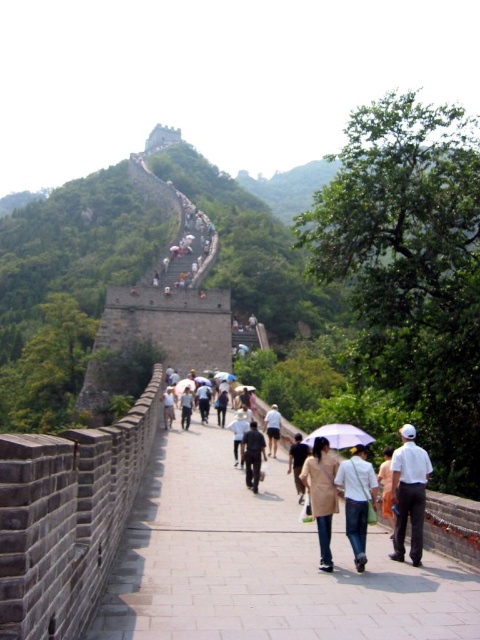
Question: Can you confirm if dark brown leather jacket at center is positioned above light brown fabric umbrella at center?

Choices:
 (A) no
 (B) yes

Answer: (A)

Question: Can you confirm if brick paved pathway at center is wider than light beige coat at center?

Choices:
 (A) no
 (B) yes

Answer: (B)

Question: Estimate the real-world distances between objects in this image. Which object is farther from the light beige coat at center?

Choices:
 (A) beige fabric coat at center
 (B) light beige cotton shirt at center
 (C) light brown fabric umbrella at center
 (D) dark gray stone person at center

Answer: (C)

Question: Estimate the real-world distances between objects in this image. Which object is farther from the light beige cotton shirt at center?

Choices:
 (A) white matte umbrella at center
 (B) light beige coat at center
 (C) white cotton shirt at center
 (D) light brown fabric umbrella at center

Answer: (B)

Question: Considering the real-world distances, which object is farthest from the white cotton shirt at center-right?

Choices:
 (A) white cotton shirt at center
 (B) dark gray stone person at center
 (C) beige fabric coat at center
 (D) brick paved pathway at center

Answer: (B)

Question: Is light beige coat at center positioned before beige fabric coat at center?

Choices:
 (A) yes
 (B) no

Answer: (B)